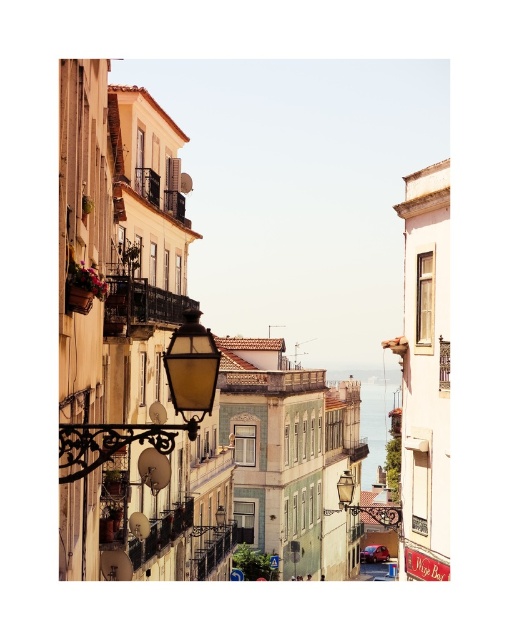
You are standing at the entrance of the street and want to find the matte black streetlamp at center. According to the coordinates provided, where should you look relative to your position?

The matte black streetlamp at center is located at point (367,506), which means it is positioned approximately 79.1 percent to the right and 72.3 percent down from your starting position at the entrance.